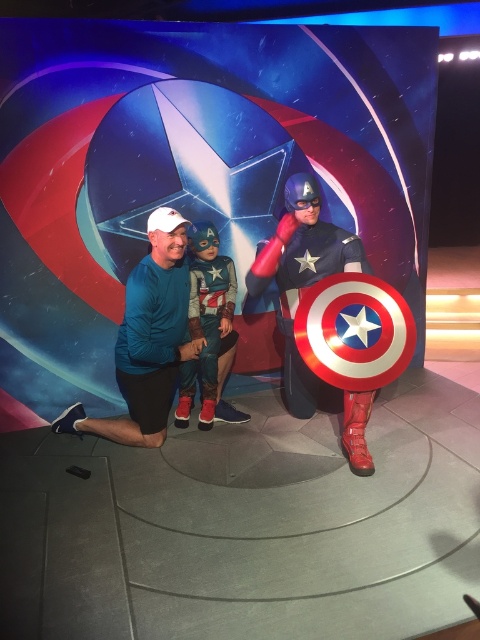
Is point (156, 294) more distant than point (336, 252)?

No, it is in front of (336, 252).

Image resolution: width=480 pixels, height=640 pixels. I want to click on blue fabric shirt at center, so click(146, 337).

From the picture: Does blue fabric shirt at center appear on the right side of shiny metallic costume at center?

Incorrect, blue fabric shirt at center is not on the right side of shiny metallic costume at center.

At what (x,y) coordinates should I click in order to perform the action: click on blue fabric shirt at center. Please return your answer as a coordinate pair (x, y). Looking at the image, I should click on (146, 337).

Image resolution: width=480 pixels, height=640 pixels. Find the location of `blue fabric shirt at center`. blue fabric shirt at center is located at coordinates (146, 337).

What are the coordinates of `shiny metallic captain america shield at center` in the screenshot? It's located at (301, 275).

This screenshot has height=640, width=480. What do you see at coordinates (301, 275) in the screenshot?
I see `shiny metallic captain america shield at center` at bounding box center [301, 275].

Which is behind, point (324, 246) or point (176, 410)?

The point (176, 410) is more distant.

At what (x,y) coordinates should I click in order to perform the action: click on shiny metallic captain america shield at center. Please return your answer as a coordinate pair (x, y). Image resolution: width=480 pixels, height=640 pixels. Looking at the image, I should click on click(301, 275).